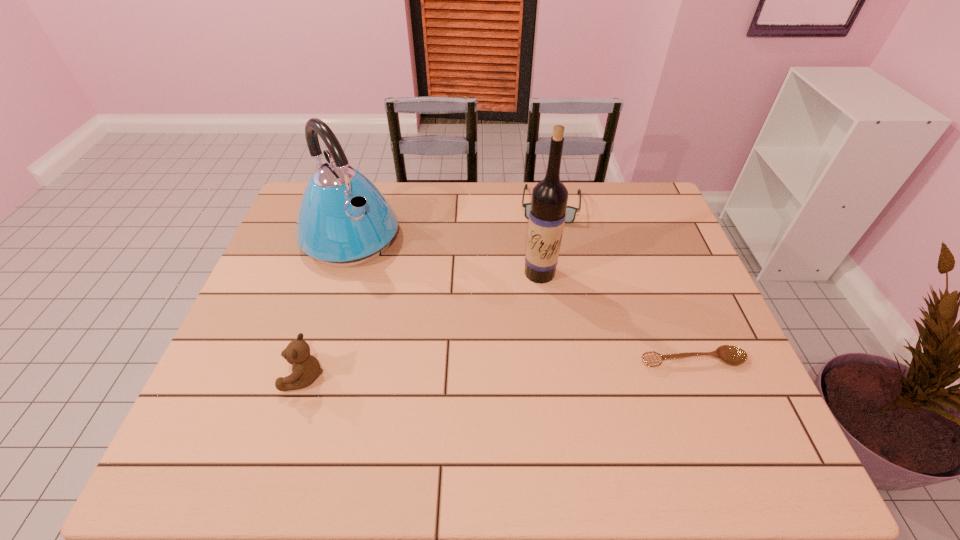
The width and height of the screenshot is (960, 540). I want to click on vacant spot on the desktop that is between the third shortest object and the shortest object and is positioned at the spout of the second tallest object, so pyautogui.click(x=471, y=369).

I want to click on free space on the desktop that is between the third tallest object and the ladle and is positioned on the face of the spectacles, so click(535, 366).

Where is `vacant spot on the desktop that is between the teddy bear and the ladle and is positioned on the label of the wine bottle`? The height and width of the screenshot is (540, 960). vacant spot on the desktop that is between the teddy bear and the ladle and is positioned on the label of the wine bottle is located at coordinates (501, 367).